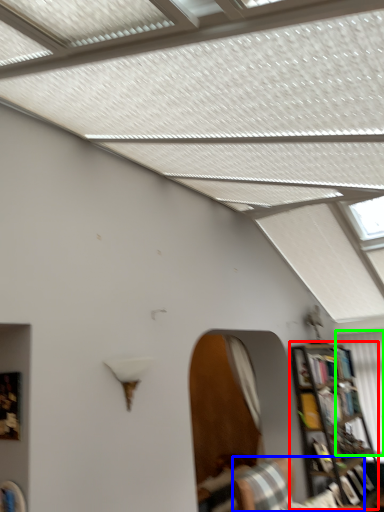
Question: Which object is the farthest from bookcase (highlighted by a red box)? Choose among these: furniture (highlighted by a blue box) or curtain (highlighted by a green box).

Choices:
 (A) furniture
 (B) curtain

Answer: (A)